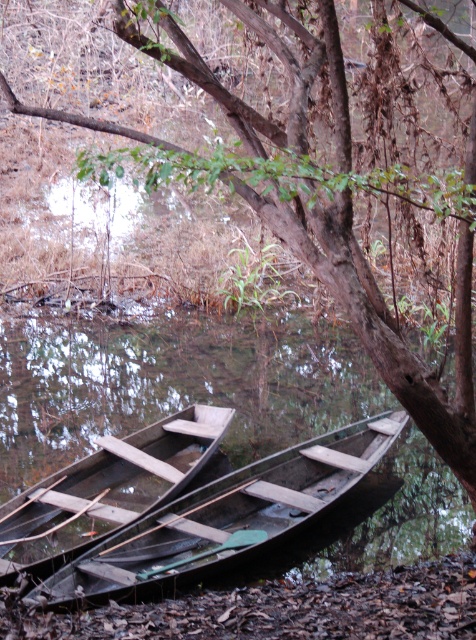
Question: Which object is farther from the camera taking this photo?

Choices:
 (A) dark wood boat at center
 (B) dark brown wooden boat at lower center

Answer: (A)

Question: Is dark brown wooden boat at lower center positioned before wooden boat at lower left?

Choices:
 (A) yes
 (B) no

Answer: (A)

Question: Does dark wood boat at center lie behind wooden boat at lower left?

Choices:
 (A) yes
 (B) no

Answer: (A)

Question: Which is nearer to the dark wood boat at center?

Choices:
 (A) dark brown wooden boat at lower center
 (B) wooden boat at lower left

Answer: (B)

Question: Among these objects, which one is nearest to the camera?

Choices:
 (A) dark brown wooden boat at lower center
 (B) dark wood boat at center

Answer: (A)

Question: Is dark brown wooden boat at lower center bigger than wooden boat at lower left?

Choices:
 (A) yes
 (B) no

Answer: (A)